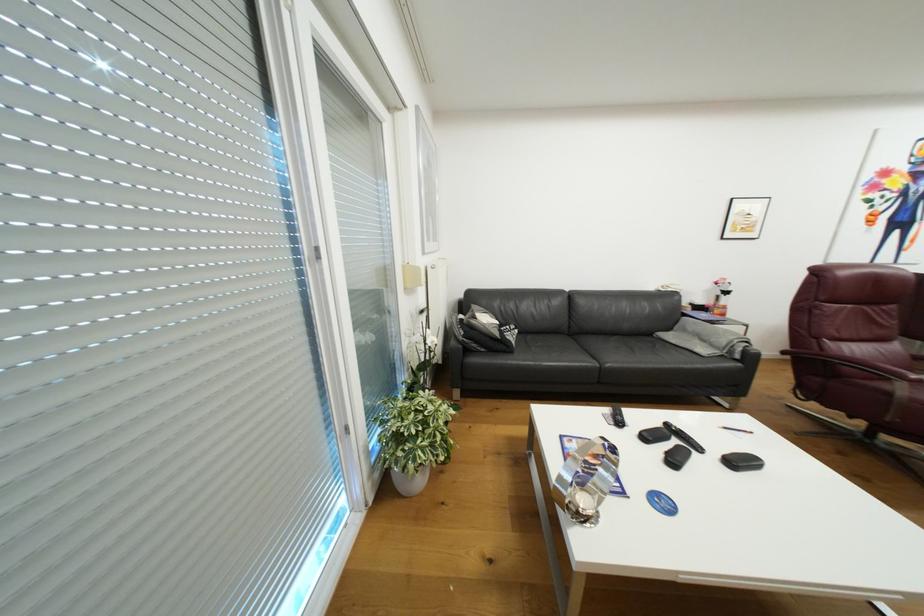
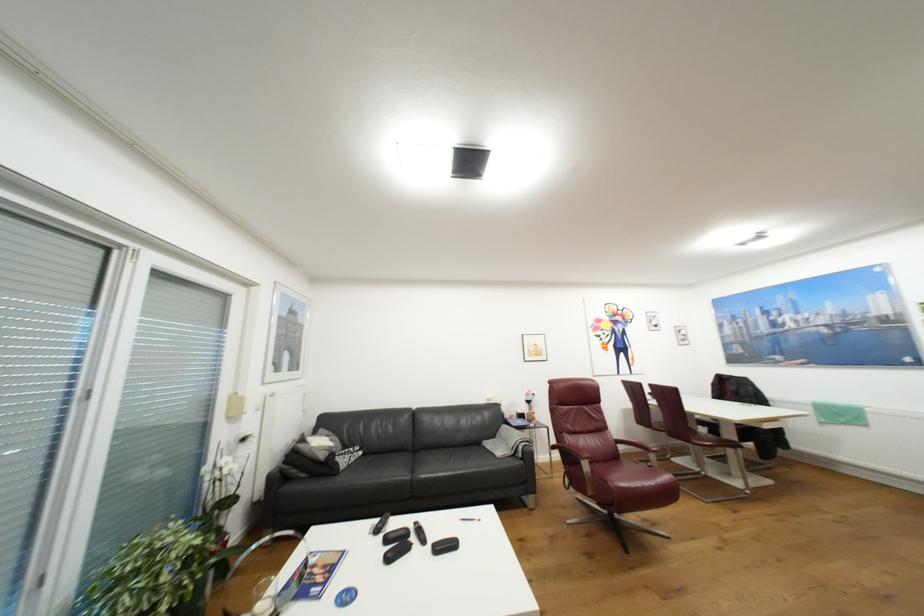
Find the pixel in the second image that matches point (791, 352) in the first image.

(560, 448)